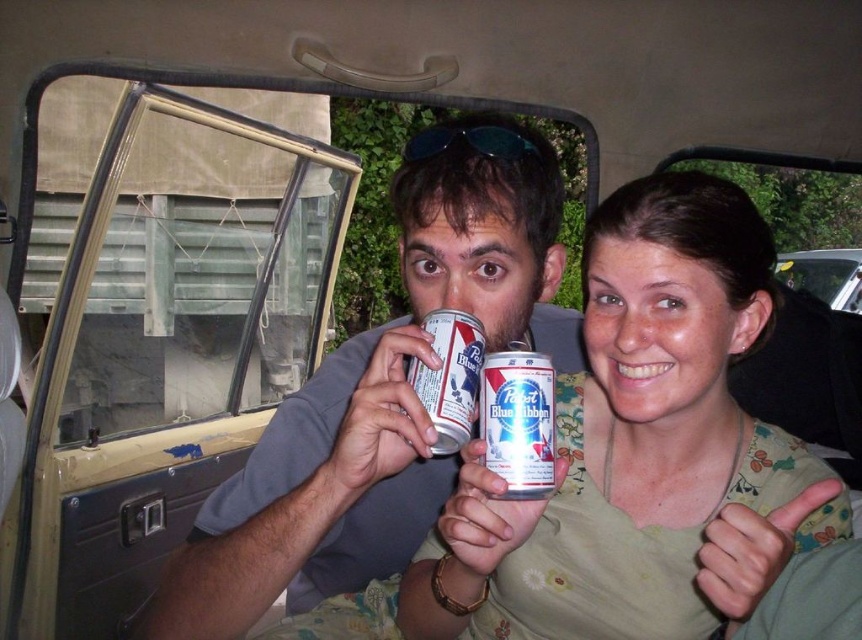
Question: Which of the following is the closest to the observer?

Choices:
 (A) (809, 259)
 (B) (582, 605)

Answer: (B)

Question: Is the position of matte silver can at center less distant than that of metallic silver car at upper right?

Choices:
 (A) yes
 (B) no

Answer: (A)

Question: Does matte green blouse at center appear over matte silver can at center?

Choices:
 (A) yes
 (B) no

Answer: (B)

Question: Among these objects, which one is nearest to the camera?

Choices:
 (A) metallic silver car at upper right
 (B) matte green blouse at center

Answer: (B)

Question: Which point is farther to the camera?

Choices:
 (A) blue metallic can at center
 (B) matte green blouse at center
 (C) matte silver can at center
 (D) metallic silver car at upper right

Answer: (D)

Question: Can you confirm if blue metallic can at center is wider than metallic silver car at upper right?

Choices:
 (A) yes
 (B) no

Answer: (B)